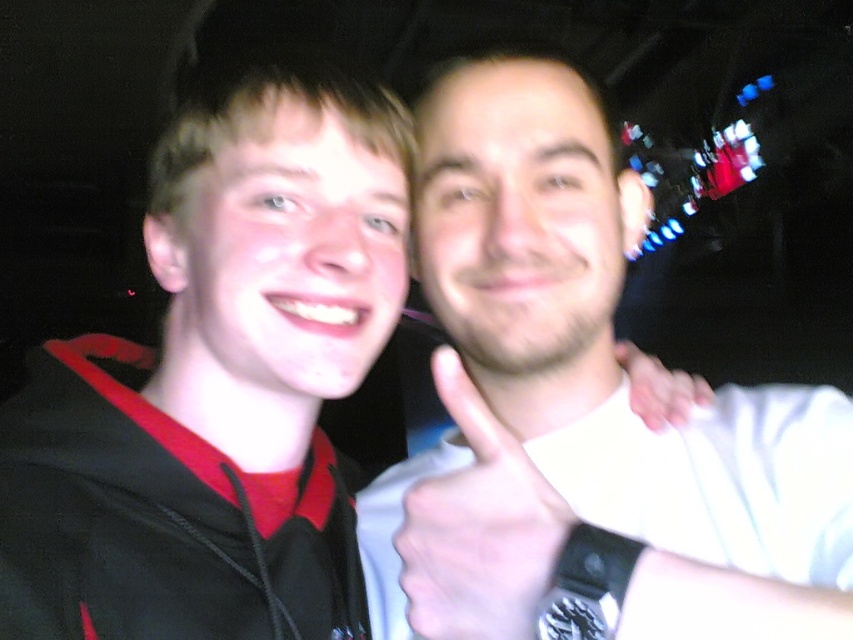
You are a photographer adjusting your camera settings to capture a clear image of the white matte shirt at upper right. Considering the shirt is 13.07 inches from the viewer, what should you set the focal length to for optimal focus?

The white matte shirt at upper right is 13.07 inches from the viewer, so you should set the focal length to match that distance for optimal focus.